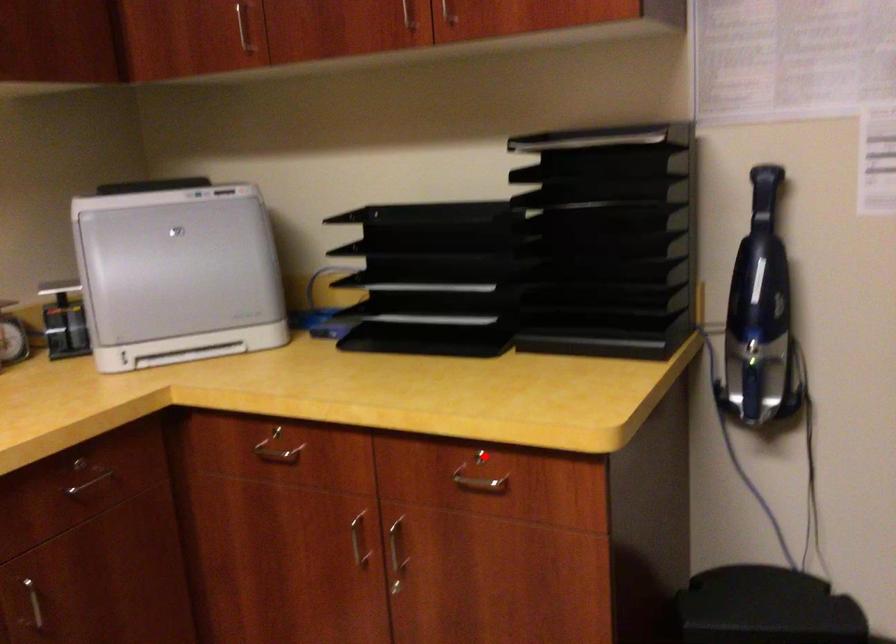
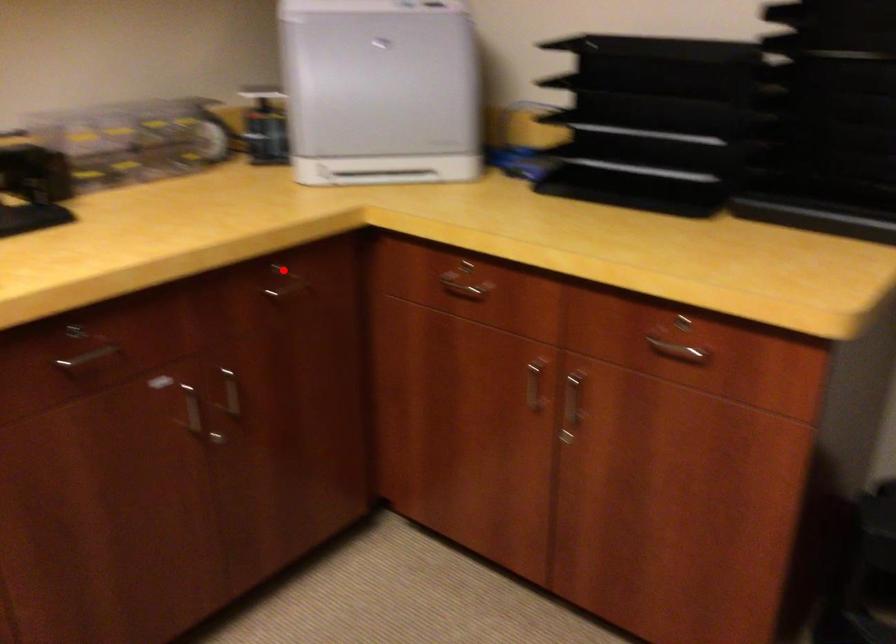
I am providing you with two images of the same scene from different viewpoints. A red point is marked on the first image and another point is marked on the second image. Are the points marked in image1 and image2 representing the same 3D position?

No